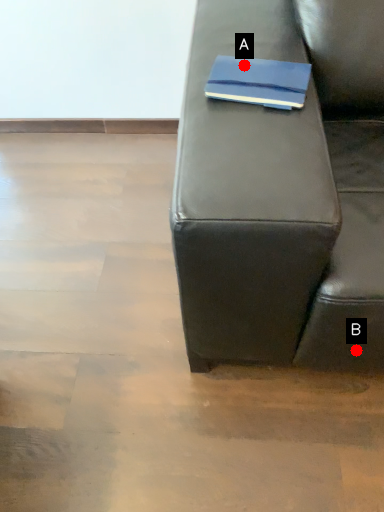
Question: Two points are circled on the image, labeled by A and B beside each circle. Among these points, which one is farthest from the camera?

Choices:
 (A) A is further
 (B) B is further

Answer: (B)